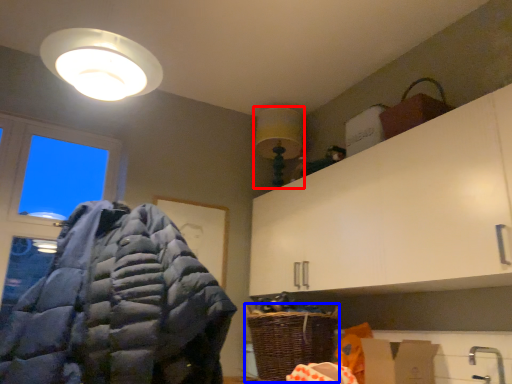
Question: Which point is further to the camera, light fixture (highlighted by a red box) or basket (highlighted by a blue box)?

Choices:
 (A) light fixture
 (B) basket

Answer: (A)